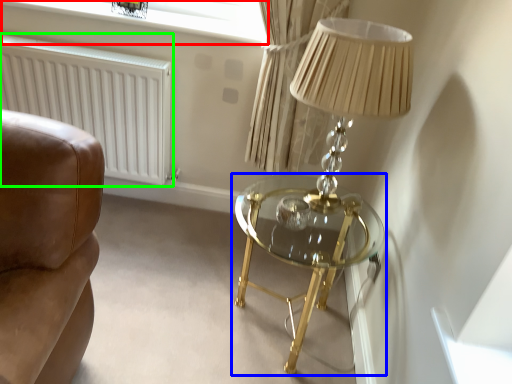
Question: Based on their relative distances, which object is farther from window screen (highlighted by a red box)? Choose from table (highlighted by a blue box) and radiator (highlighted by a green box).

Choices:
 (A) table
 (B) radiator

Answer: (A)